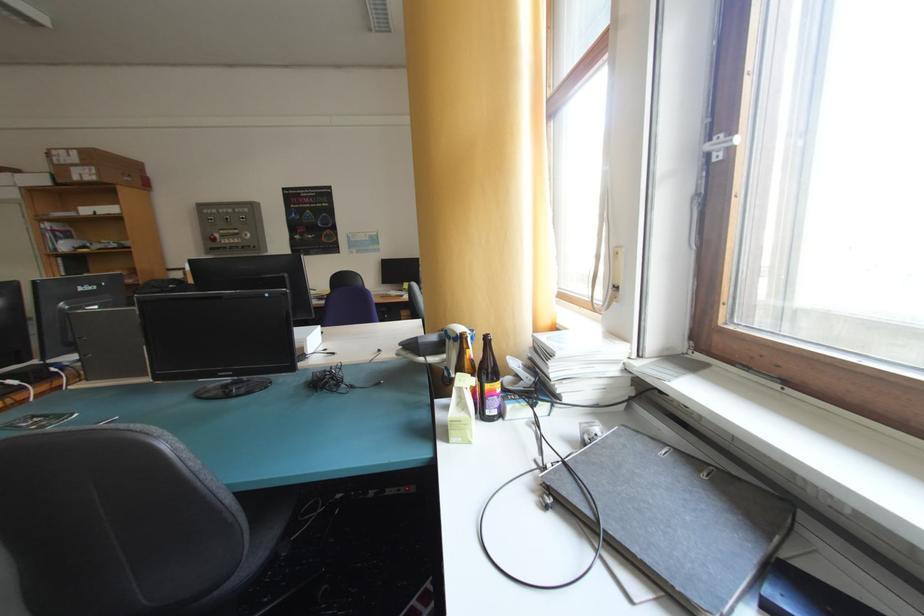
Locate an element on the screen. white window handle is located at coordinates (720, 145).